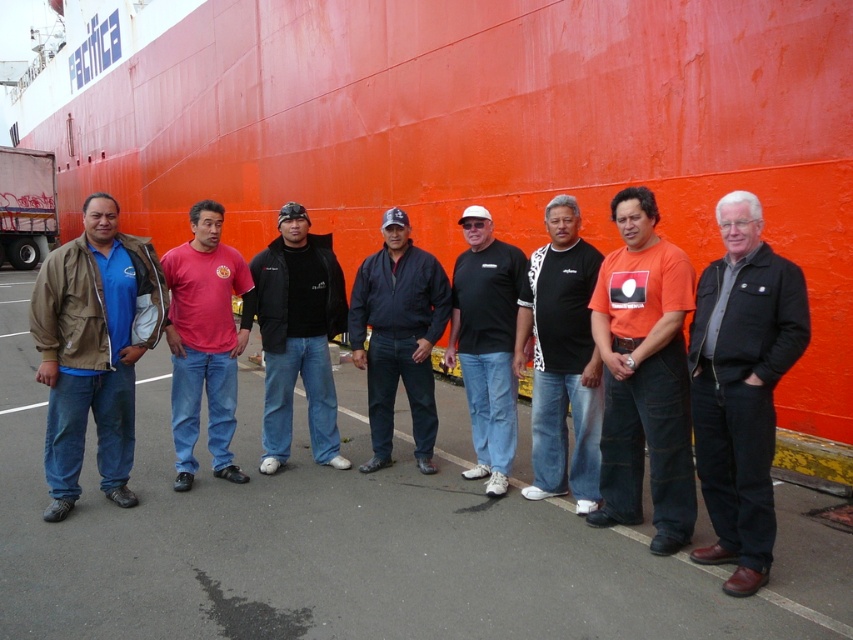
Between point (605, 436) and point (476, 268), which one is positioned in front?

Point (605, 436) is in front.

Does point (677, 497) come closer to viewer compared to point (456, 349)?

Yes.

Where is `orange cotton t-shirt at center`? orange cotton t-shirt at center is located at coordinates (643, 376).

Is orange cotton t-shirt at center shorter than white matte trailer truck at left?

Indeed, orange cotton t-shirt at center has a lesser height compared to white matte trailer truck at left.

Locate an element on the screen. orange cotton t-shirt at center is located at coordinates (643, 376).

Find the location of `orange cotton t-shirt at center`. orange cotton t-shirt at center is located at coordinates (643, 376).

Find the location of a particular element. The image size is (853, 640). orange cotton t-shirt at center is located at coordinates (643, 376).

Does black jersey at center have a lesser width compared to black matte shirt at center?

Correct, black jersey at center's width is less than black matte shirt at center's.

At what (x,y) coordinates should I click in order to perform the action: click on black jersey at center. Please return your answer as a coordinate pair (x, y). Looking at the image, I should click on (561, 358).